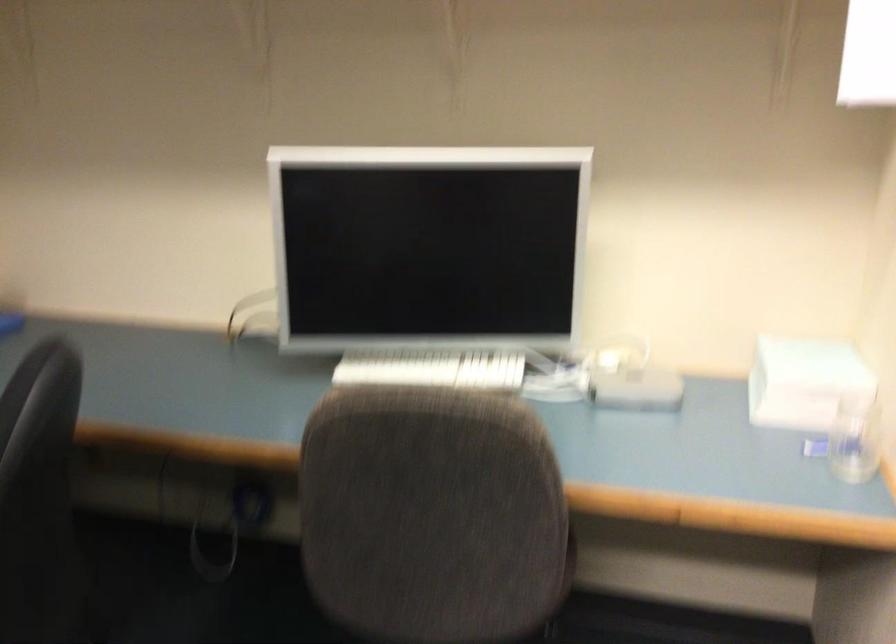
Question: The camera is either moving clockwise (left) or counter-clockwise (right) around the object. The first image is from the beginning of the video and the second image is from the end. Is the camera moving left or right when shooting the video?

Choices:
 (A) Left
 (B) Right

Answer: (A)